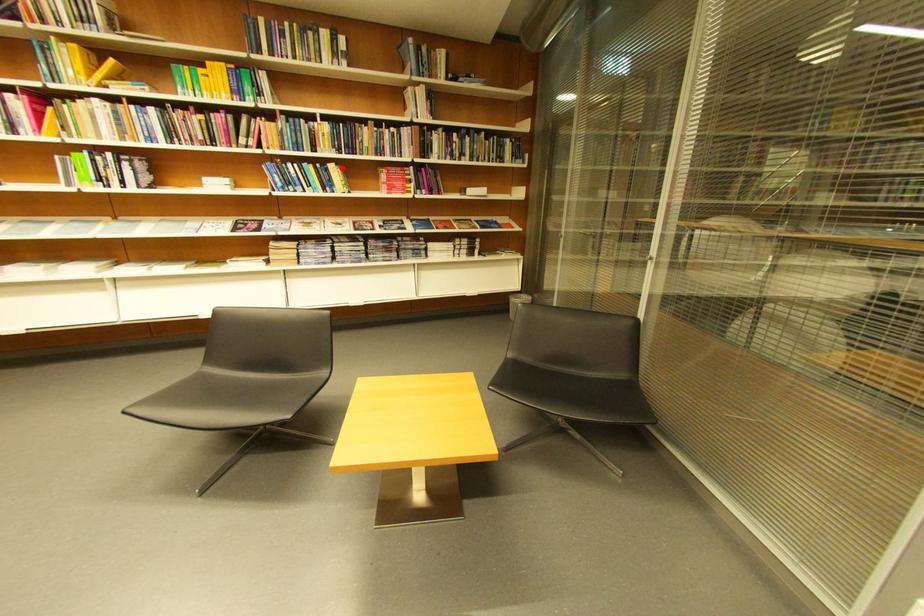
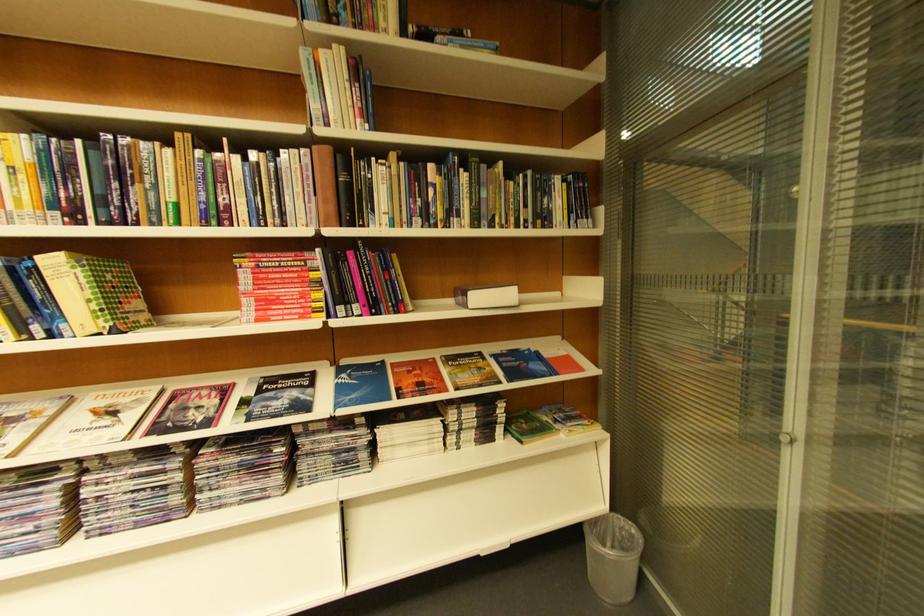
Question: I am providing you with two images of the same scene from different viewpoints. A red point is shown in image1. For the corresponding object point in image2, is it positioned nearer or farther from the camera?

Choices:
 (A) Nearer
 (B) Farther

Answer: (B)